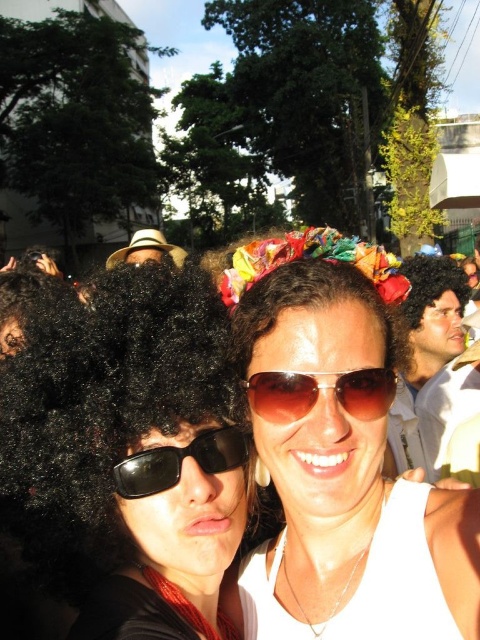
Does matte white shirt at center lie in front of black reflective sunglasses at left?

No, it is not.

Measure the distance between matte white shirt at center and camera.

matte white shirt at center is 3.04 meters away from camera.

Does point (450, 305) lie behind point (215, 436)?

That is True.

This screenshot has width=480, height=640. Identify the location of matte white shirt at center. (422, 348).

The image size is (480, 640). Find the location of `sunglasses at center`. sunglasses at center is located at coordinates (343, 474).

Can you confirm if sunglasses at center is smaller than white straw hat at center?

Yes, sunglasses at center is smaller than white straw hat at center.

In order to click on sunglasses at center in this screenshot , I will do `click(343, 474)`.

Is the position of matte white shirt at center less distant than that of white straw hat at center?

No, it is behind white straw hat at center.

Which is below, matte white shirt at center or white straw hat at center?

Positioned lower is matte white shirt at center.

Which is behind, point (402, 374) or point (111, 259)?

The point (111, 259) is behind.

Locate an element on the screen. Image resolution: width=480 pixels, height=640 pixels. matte white shirt at center is located at coordinates (422, 348).